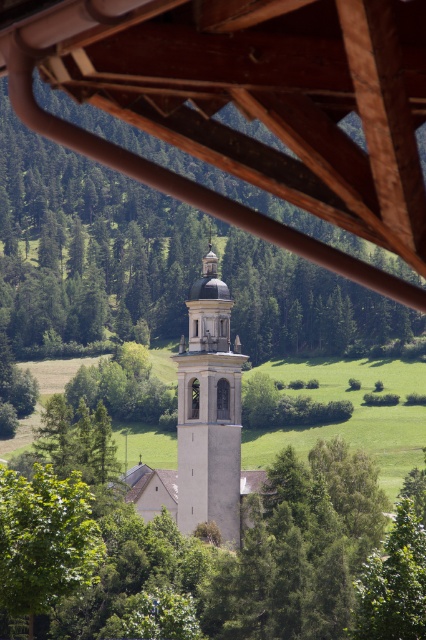
Is smooth white tower at center to the right of green leafy tree at lower left from the viewer's perspective?

Indeed, smooth white tower at center is positioned on the right side of green leafy tree at lower left.

Is point (187, 384) positioned in front of point (83, 580)?

No.

I want to click on smooth white tower at center, so click(x=209, y=410).

Who is positioned more to the left, green leafy tree at center or green leafy tree at lower left?

From the viewer's perspective, green leafy tree at lower left appears more on the left side.

Which of these two, green leafy tree at center or green leafy tree at lower left, stands taller?

Standing taller between the two is green leafy tree at center.

Who is more forward, (40, 172) or (48, 572)?

Point (48, 572) is more forward.

The image size is (426, 640). I want to click on green leafy tree at center, so click(x=89, y=244).

Does white stone tower at center have a smaller size compared to smooth white tower at center?

No, white stone tower at center is not smaller than smooth white tower at center.

Is white stone tower at center in front of smooth white tower at center?

Yes, it is in front of smooth white tower at center.

Measure the distance between point (222,410) and camera.

The distance of point (222,410) from camera is 542.64 feet.

Where is `white stone tower at center`? This screenshot has width=426, height=640. white stone tower at center is located at coordinates (204, 422).